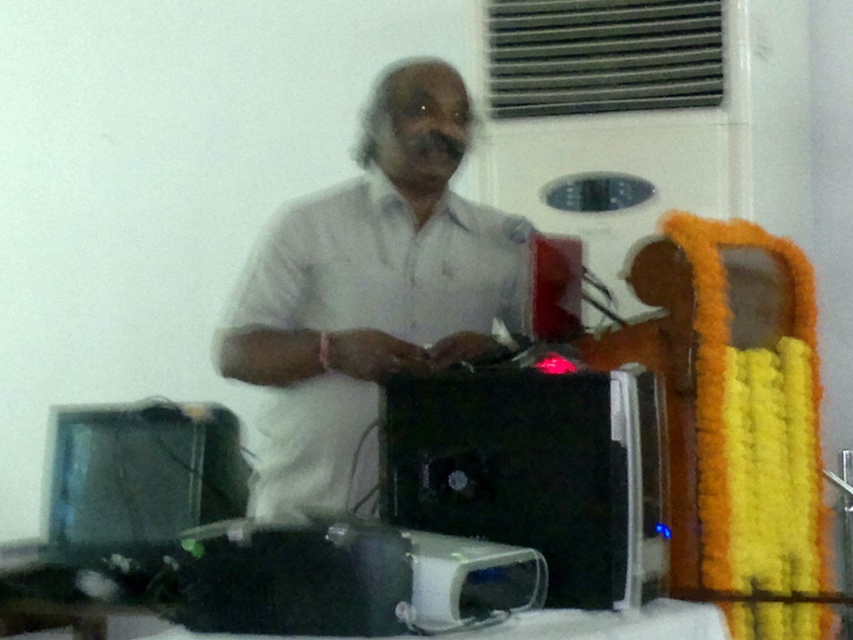
Who is higher up, white matte shirt at center or black plastic computer at lower left?

white matte shirt at center

Image resolution: width=853 pixels, height=640 pixels. Describe the element at coordinates (369, 292) in the screenshot. I see `white matte shirt at center` at that location.

What are the coordinates of `white matte shirt at center` in the screenshot? It's located at (369, 292).

Locate an element on the screen. white matte shirt at center is located at coordinates (369, 292).

Does black plastic computer at center have a greater height compared to black plastic computer at lower left?

Yes.

Describe the element at coordinates (537, 472) in the screenshot. Image resolution: width=853 pixels, height=640 pixels. I see `black plastic computer at center` at that location.

Between point (566, 468) and point (242, 483), which one is positioned in front?

Point (566, 468)

Where is `black plastic computer at center`? black plastic computer at center is located at coordinates (537, 472).

Between point (357, 230) and point (554, 528), which one is positioned behind?

The point (357, 230) is behind.

Between white matte shirt at center and black plastic computer at center, which one appears on the right side from the viewer's perspective?

black plastic computer at center is more to the right.

Which is in front, point (303, 467) or point (573, 426)?

Positioned in front is point (573, 426).

I want to click on white matte shirt at center, so (x=369, y=292).